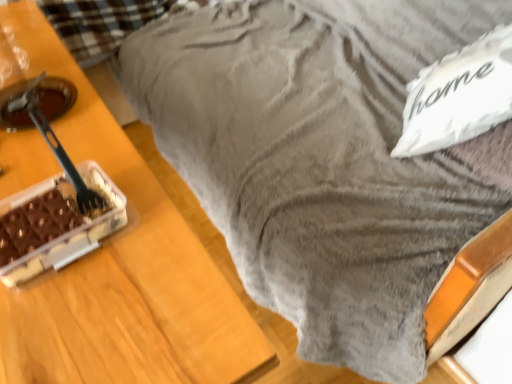
Image resolution: width=512 pixels, height=384 pixels. Find the location of `unoccupied area behind chocolate matte cake at left`. unoccupied area behind chocolate matte cake at left is located at coordinates (84, 152).